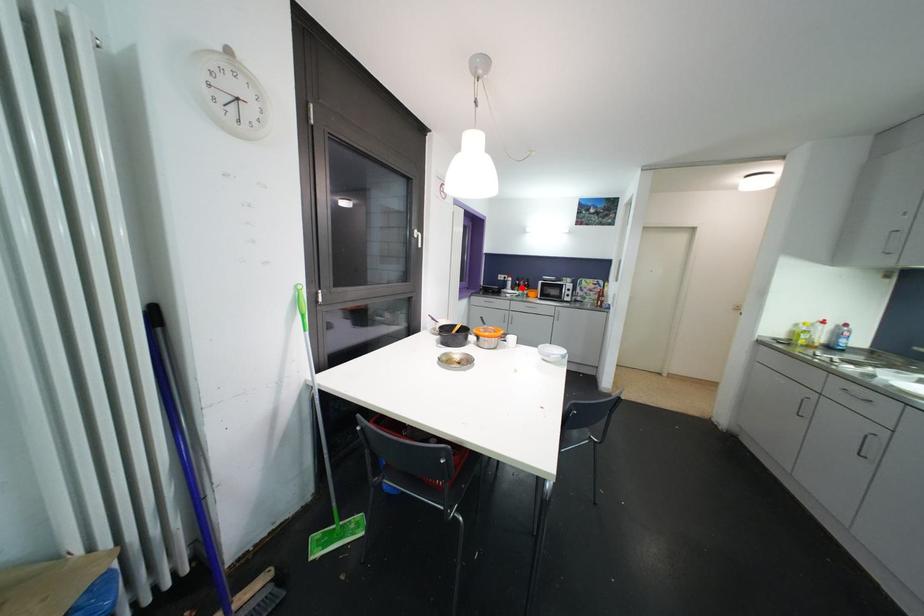
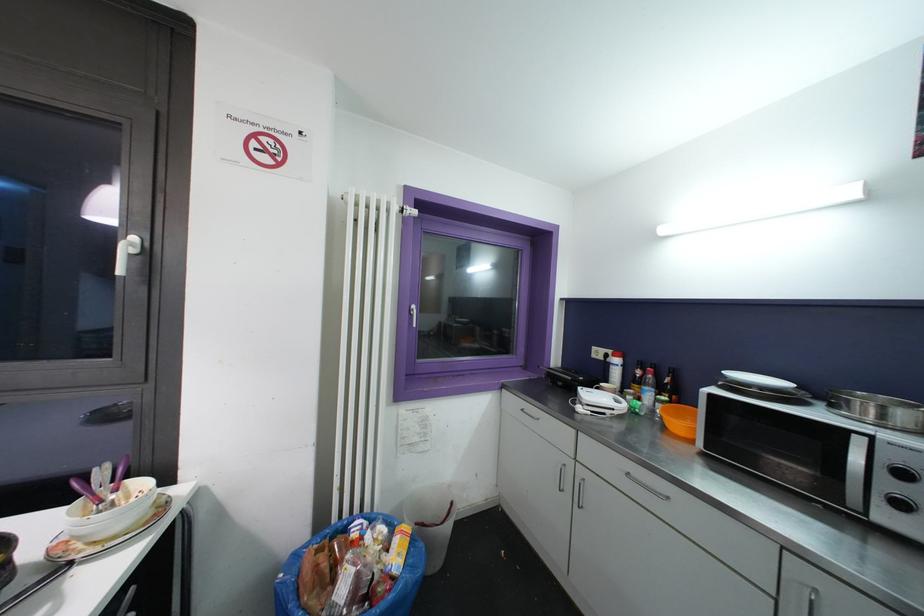
Question: I am providing you with two images of the same scene from different viewpoints. Given a red point in image1, look at the same physical point in image2. Is it:

Choices:
 (A) Closer to the viewpoint
 (B) Farther from the viewpoint

Answer: (B)